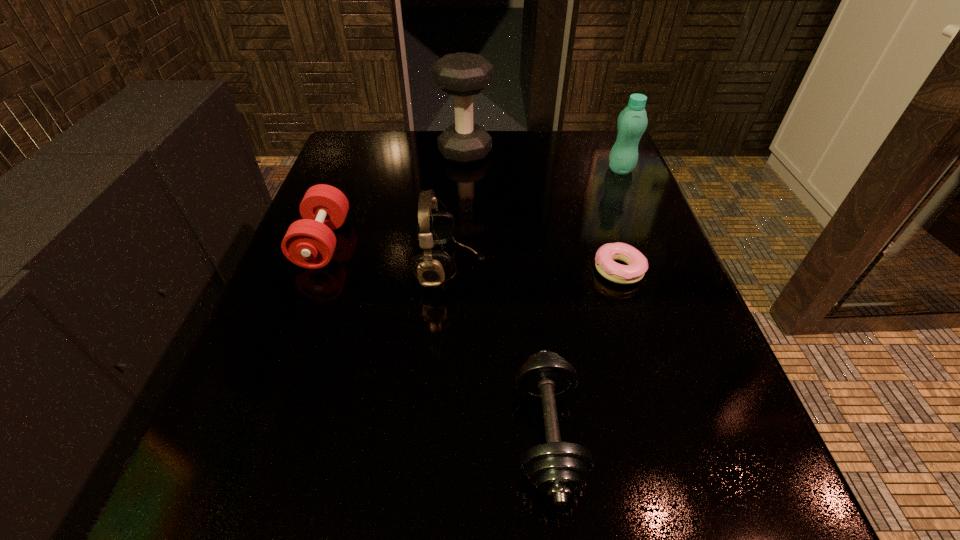
You are a GUI agent. You are given a task and a screenshot of the screen. Output one action in this format:
    pyautogui.click(x=<x>, y=<y>)
    Task: Click on the fifth closest object to the rightmost object
    This screenshot has width=960, height=540.
    Given the screenshot: What is the action you would take?
    pyautogui.click(x=310, y=242)

Select which dumbbell appears as the closest to the second object from right to left. Please provide its 2D coordinates. Your answer should be formatted as a tuple, i.e. [(x, y)], where the tuple contains the x and y coordinates of a point satisfying the conditions above.

[(557, 469)]

The height and width of the screenshot is (540, 960). Find the location of `dumbbell object that ranks as the second closest to the doughnut`. dumbbell object that ranks as the second closest to the doughnut is located at coordinates (463, 75).

The image size is (960, 540). Find the location of `vacant space that satisfies the following two spatial constraints: 1. with the microphone on the side of the headset; 2. on the left side of the fourth object from left to right`. vacant space that satisfies the following two spatial constraints: 1. with the microphone on the side of the headset; 2. on the left side of the fourth object from left to right is located at coordinates (440, 434).

You are a GUI agent. You are given a task and a screenshot of the screen. Output one action in this format:
    pyautogui.click(x=<x>, y=<y>)
    Task: Click on the free location that satisfies the following two spatial constraints: 1. on the front side of the second dumbbell from right to left; 2. on the left side of the fourth object from left to right
    The height and width of the screenshot is (540, 960).
    Given the screenshot: What is the action you would take?
    pyautogui.click(x=452, y=434)

Where is `free region that satisfies the following two spatial constraints: 1. on the back side of the rightmost object; 2. on the right side of the nearest object`? free region that satisfies the following two spatial constraints: 1. on the back side of the rightmost object; 2. on the right side of the nearest object is located at coordinates (517, 169).

This screenshot has width=960, height=540. Identify the location of vacant region that satisfies the following two spatial constraints: 1. on the front side of the farthest dumbbell; 2. with the microphone on the side of the headset. (460, 267).

Locate an element on the screen. This screenshot has width=960, height=540. vacant space that satisfies the following two spatial constraints: 1. with the microphone on the side of the headset; 2. on the left side of the third object from right to left is located at coordinates (440, 434).

This screenshot has width=960, height=540. What are the coordinates of `vacant space that satisfies the following two spatial constraints: 1. with the microphone on the side of the shortest object; 2. on the left side of the headset` in the screenshot? It's located at (450, 270).